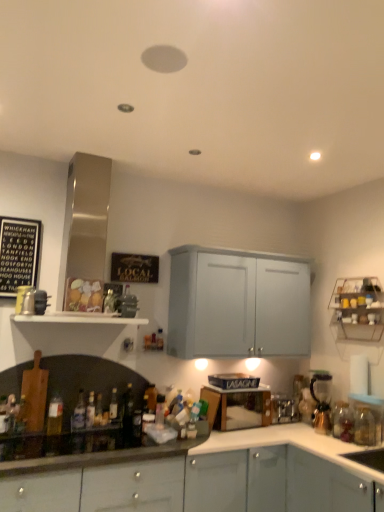
Question: Is metallic wire rack at upper right, arranged as the first shelf when viewed from the right, to the left or to the right of translucent glass bottle at lower left, which is the eighth bottle in right-to-left order, in the image?

Choices:
 (A) right
 (B) left

Answer: (A)

Question: Is point (342, 335) positioned closer to the camera than point (59, 398)?

Choices:
 (A) closer
 (B) farther

Answer: (B)

Question: Estimate the real-world distances between objects in this image. Which object is farther from the translucent glass bottle at lower left, which is the seventh bottle in left-to-right order?

Choices:
 (A) matte gray cabinets at lower right, positioned as the 1th cabinetry in left-to-right order
 (B) translucent glass bottle at lower left, the seventh bottle when ordered from right to left
 (C) translucent glass bottle at lower center, marked as the 3th bottle in a right-to-left arrangement
 (D) shiny glass bottles at lower left
 (E) translucent glass bottle at lower left, positioned as the sixth bottle in left-to-right order

Answer: (A)

Question: Estimate the real-world distances between objects in this image. Which object is closer to the white matte shelf at center, the first shelf when ordered from left to right?

Choices:
 (A) translucent glass bottle at lower left, the tenth bottle positioned from the right
 (B) matte gray cabinets at lower right, acting as the 2th cabinetry starting from the right
 (C) translucent glass bottle at left, the 2th bottle positioned from the left
 (D) black matte signboard at upper left
 (E) translucent glass bottle at lower right, positioned as the 1th bottle in right-to-left order

Answer: (D)